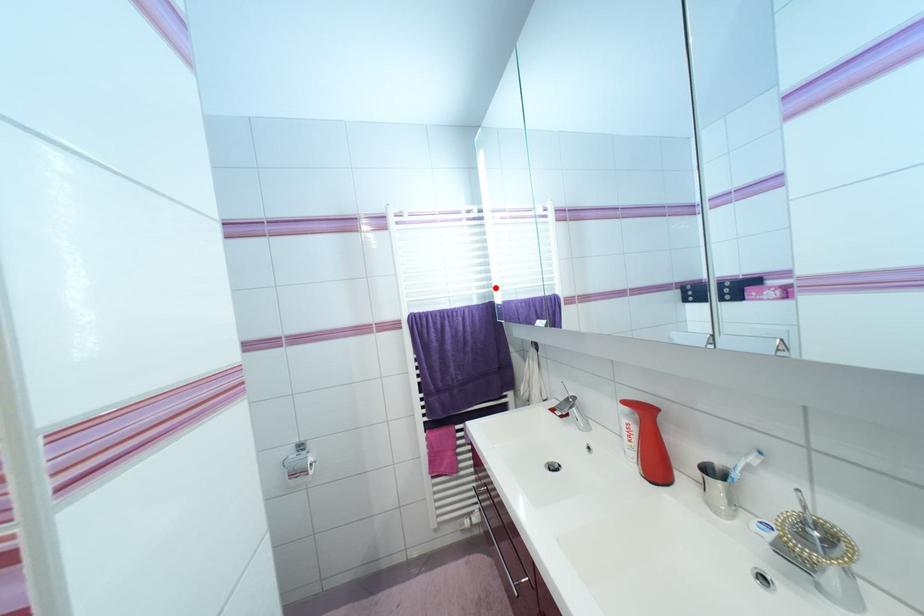
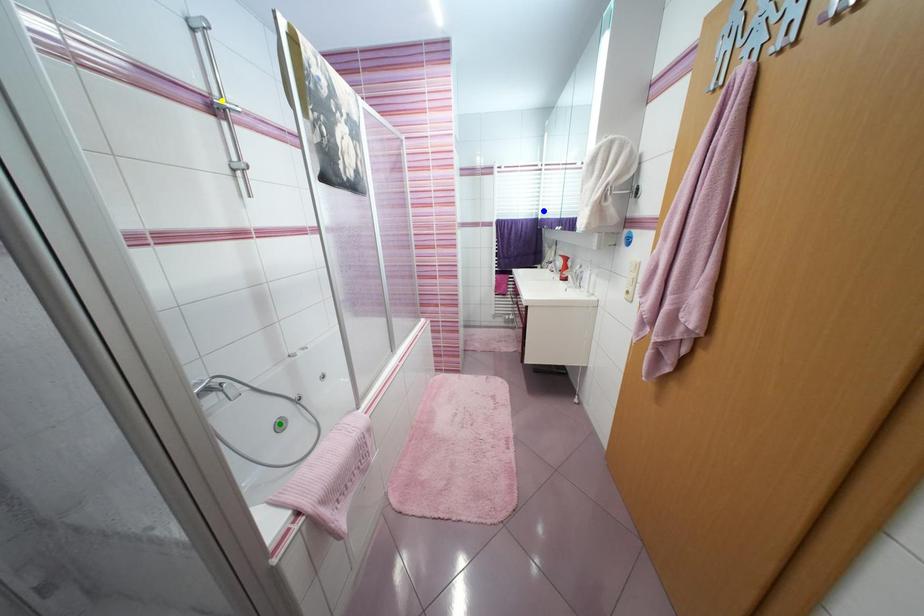
Question: I am providing you with two images of the same scene from different viewpoints. A red point is marked on the first image. You are given multiple points on the second image. Which point in image 2 is actually the same real-world point as the red point in image 1?

Choices:
 (A) blue point
 (B) yellow point
 (C) green point

Answer: (A)